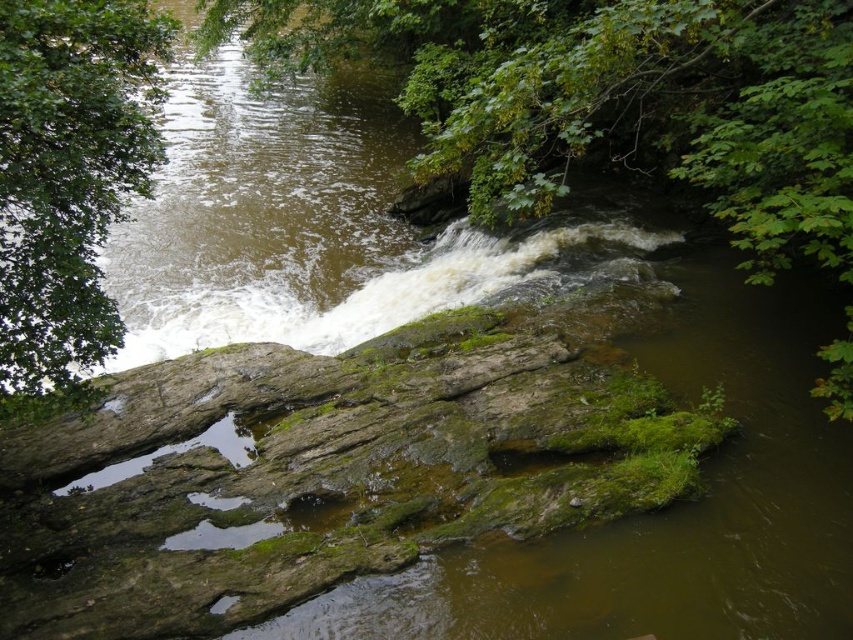
Question: Does green leafy tree at upper center have a lesser width compared to green leafy tree at upper left?

Choices:
 (A) yes
 (B) no

Answer: (B)

Question: Among these objects, which one is nearest to the camera?

Choices:
 (A) green leafy tree at upper left
 (B) green leafy tree at upper center

Answer: (A)

Question: Is green leafy tree at upper center in front of green leafy tree at upper left?

Choices:
 (A) yes
 (B) no

Answer: (B)

Question: Can you confirm if green leafy tree at upper center is positioned below green leafy tree at upper left?

Choices:
 (A) yes
 (B) no

Answer: (B)